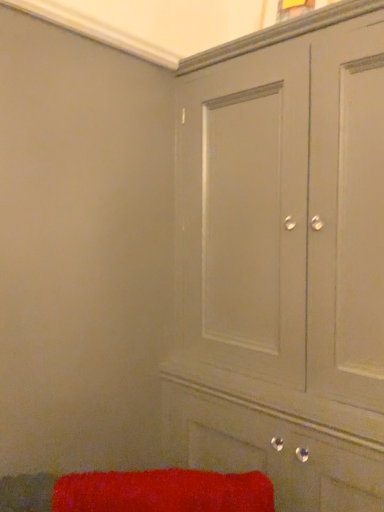
Describe the element at coordinates (283, 261) in the screenshot. I see `matte gray cupboard at center` at that location.

The width and height of the screenshot is (384, 512). Find the location of `matte gray cupboard at center`. matte gray cupboard at center is located at coordinates 283,261.

This screenshot has height=512, width=384. In order to click on matte gray cupboard at center in this screenshot , I will do `click(283, 261)`.